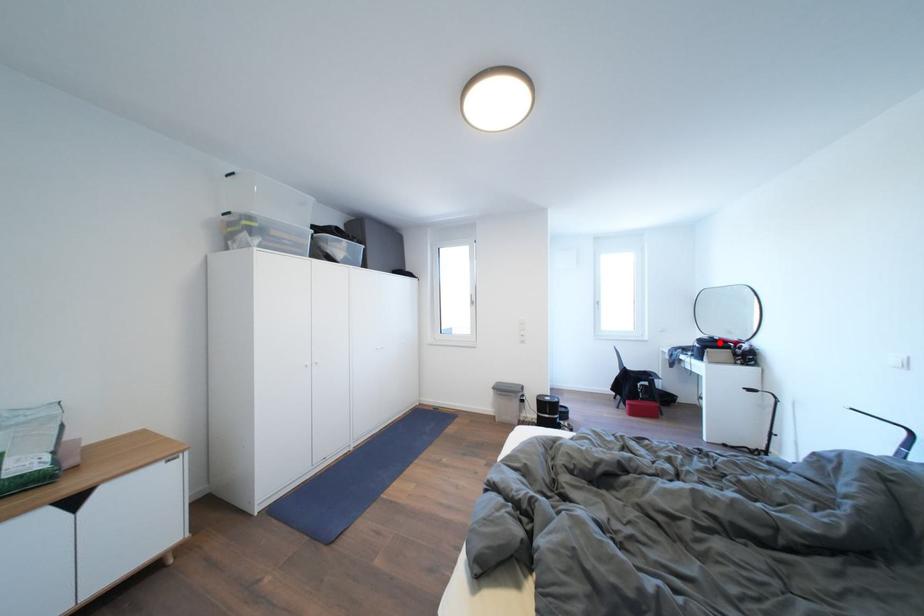
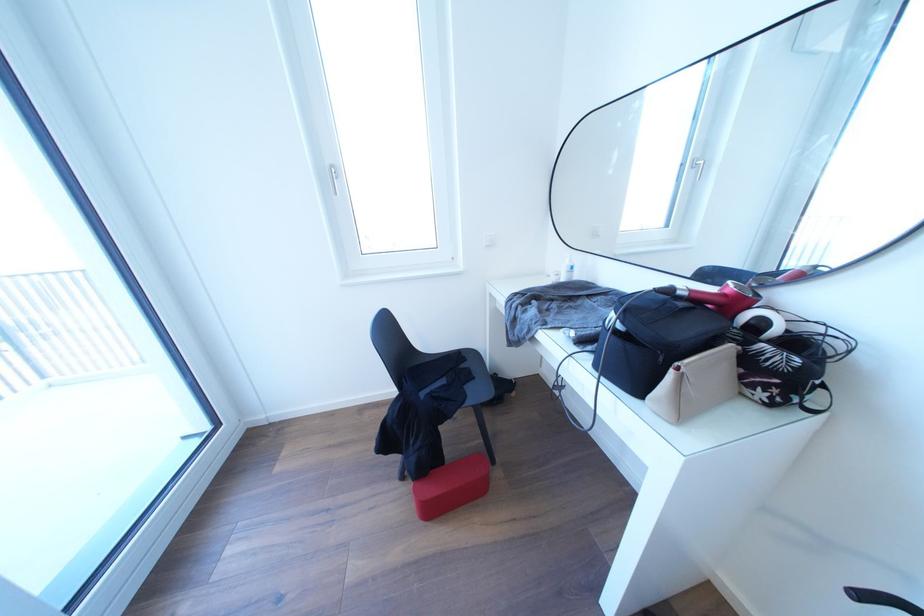
Where in the second image is the point corresponding to the highlighted location from the first image?

(675, 296)